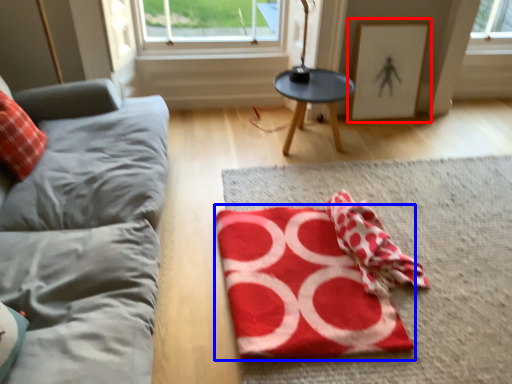
Question: Which point is further to the camera, picture frame (highlighted by a red box) or yoga mat (highlighted by a blue box)?

Choices:
 (A) picture frame
 (B) yoga mat

Answer: (A)